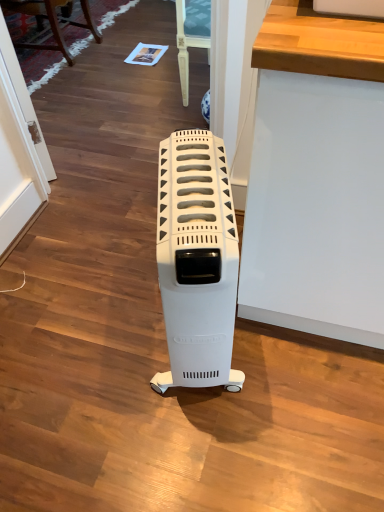
You are a GUI agent. You are given a task and a screenshot of the screen. Output one action in this format:
    pyautogui.click(x=<x>, y=<y>)
    Task: Click on the vacant point above white plastic heater at center (from a real-world perspective)
    
    Given the screenshot: What is the action you would take?
    pyautogui.click(x=203, y=193)